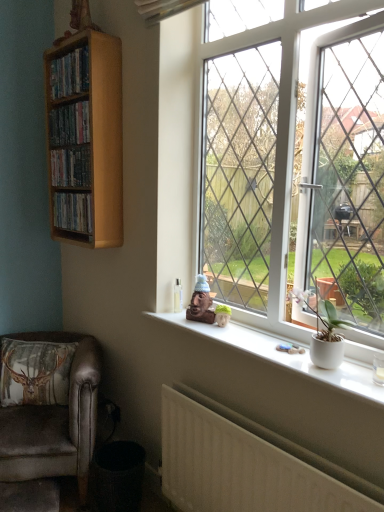
Question: Is wooden shelf at left, the 2th book viewed from the top, to the left of white matte pot at window from the viewer's perspective?

Choices:
 (A) no
 (B) yes

Answer: (B)

Question: From the image's perspective, is wooden shelf at left, the 2th book viewed from the top, located above white matte pot at window?

Choices:
 (A) no
 (B) yes

Answer: (B)

Question: Is wooden shelf at left, the 2th book viewed from the top, oriented towards white matte pot at window?

Choices:
 (A) yes
 (B) no

Answer: (B)

Question: Is wooden shelf at left, the 2th book viewed from the top, positioned behind white matte pot at window?

Choices:
 (A) yes
 (B) no

Answer: (A)

Question: Considering the relative sizes of wooden shelf at left, the 2th book viewed from the top, and white matte pot at window in the image provided, is wooden shelf at left, the 2th book viewed from the top, wider than white matte pot at window?

Choices:
 (A) no
 (B) yes

Answer: (B)

Question: Does wooden shelf at left, which ranks as the second book in bottom-to-top order, appear on the right side of white matte pot at window?

Choices:
 (A) no
 (B) yes

Answer: (A)

Question: Considering the relative positions of wooden shelf at upper left, positioned as the 1th book in top-to-bottom order, and white plastic window at center in the image provided, is wooden shelf at upper left, positioned as the 1th book in top-to-bottom order, in front of white plastic window at center?

Choices:
 (A) yes
 (B) no

Answer: (B)

Question: Is the depth of wooden shelf at upper left, which appears as the third book when ordered from the bottom, greater than that of white plastic window at center?

Choices:
 (A) no
 (B) yes

Answer: (B)

Question: Is wooden shelf at upper left, positioned as the 1th book in top-to-bottom order, facing away from white plastic window at center?

Choices:
 (A) no
 (B) yes

Answer: (A)

Question: Is wooden shelf at upper left, which appears as the third book when ordered from the bottom, wider than white plastic window at center?

Choices:
 (A) no
 (B) yes

Answer: (B)

Question: Is white plastic window at center completely or partially inside wooden shelf at upper left, positioned as the 1th book in top-to-bottom order?

Choices:
 (A) yes
 (B) no

Answer: (B)

Question: Considering the relative sizes of wooden shelf at upper left, which appears as the third book when ordered from the bottom, and white plastic window at center in the image provided, is wooden shelf at upper left, which appears as the third book when ordered from the bottom, smaller than white plastic window at center?

Choices:
 (A) yes
 (B) no

Answer: (A)

Question: Is wooden shelf at upper left, which appears as the third book when ordered from the bottom, shorter than velvety brown pillow at lower left?

Choices:
 (A) no
 (B) yes

Answer: (B)